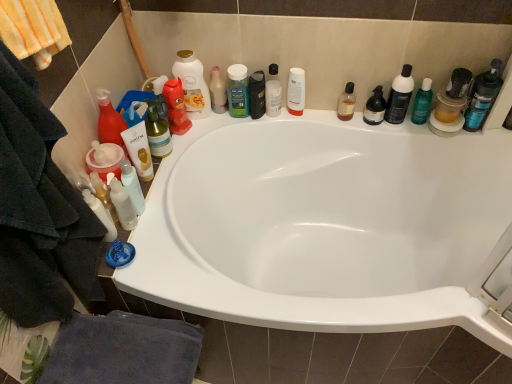
Question: Considering the positions of translucent plastic bottle at upper center, marked as the fifth toiletry in a left-to-right arrangement, and white glossy bottle at lower left, placed as the first mouthwash when sorted from left to right, in the image, is translucent plastic bottle at upper center, marked as the fifth toiletry in a left-to-right arrangement, bigger or smaller than white glossy bottle at lower left, placed as the first mouthwash when sorted from left to right,?

Choices:
 (A) big
 (B) small

Answer: (A)

Question: Looking at their shapes, would you say translucent plastic bottle at upper center, marked as the fifth toiletry in a left-to-right arrangement, is wider or thinner than white glossy bottle at lower left, the sixth mouthwash in the right-to-left sequence?

Choices:
 (A) wide
 (B) thin

Answer: (A)

Question: Which of these objects is positioned farthest from the white glossy mouthwash at upper center, arranged as the second mouthwash when viewed from the left?

Choices:
 (A) black matte bottle at center
 (B) black glossy mouthwash at upper right, acting as the 1th mouthwash starting from the right
 (C) translucent plastic bottle at upper center, marked as the 3th toiletry in a right-to-left arrangement
 (D) translucent plastic spray bottle at upper right, acting as the sixth toiletry starting from the left
 (E) white glossy bottle at lower left, placed as the first mouthwash when sorted from left to right

Answer: (B)

Question: Estimate the real-world distances between objects in this image. Which object is farther from the transparent plastic bottle at upper center, the 4th mouthwash when ordered from right to left?

Choices:
 (A) translucent plastic spray bottle at upper right, acting as the sixth toiletry starting from the left
 (B) white matte bottle at upper center, arranged as the 3th mouthwash when viewed from the right
 (C) translucent plastic bottle at upper center, which is the 4th toiletry in right-to-left order
 (D) black matte bottle at center
 (E) white glossy lotion at lower left, placed as the 1th toiletry when sorted from left to right

Answer: (E)